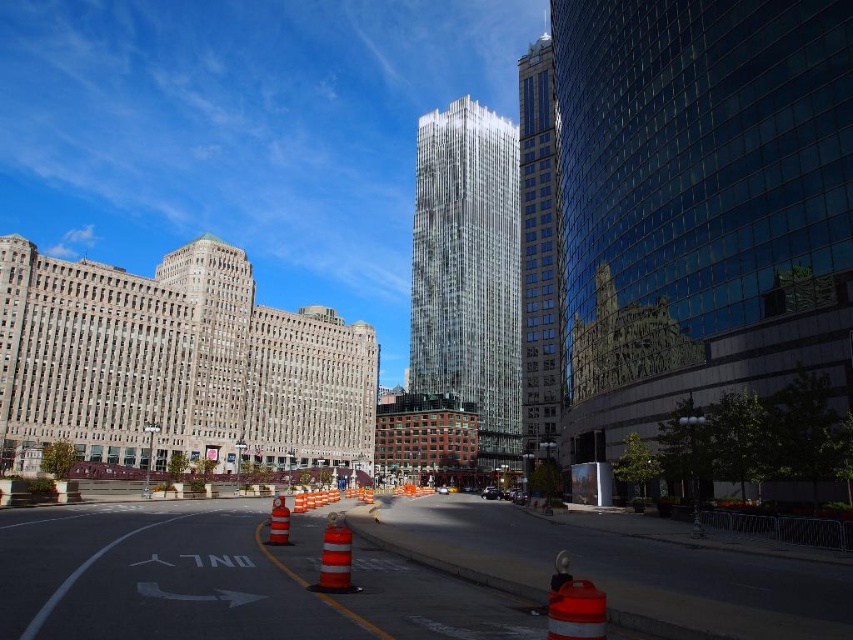
Question: Does shiny glass skyscraper at center appear on the right side of orange reflective cone at center?

Choices:
 (A) no
 (B) yes

Answer: (B)

Question: Among these points, which one is farthest from the camera?

Choices:
 (A) (328, 532)
 (B) (525, 202)
 (C) (270, 520)

Answer: (B)

Question: Which is nearer to the shiny glass skyscraper at center?

Choices:
 (A) orange reflective cone at center
 (B) reflective orange traffic cone at center

Answer: (B)

Question: Is clear glass skyscraper at center to the right of shiny glass skyscraper at center from the viewer's perspective?

Choices:
 (A) yes
 (B) no

Answer: (B)

Question: Considering the real-world distances, which object is closest to the clear glass skyscraper at center?

Choices:
 (A) shiny glass skyscraper at center
 (B) reflective orange traffic cone at center

Answer: (A)

Question: Can you confirm if clear glass skyscraper at center is bigger than shiny glass skyscraper at center?

Choices:
 (A) yes
 (B) no

Answer: (B)